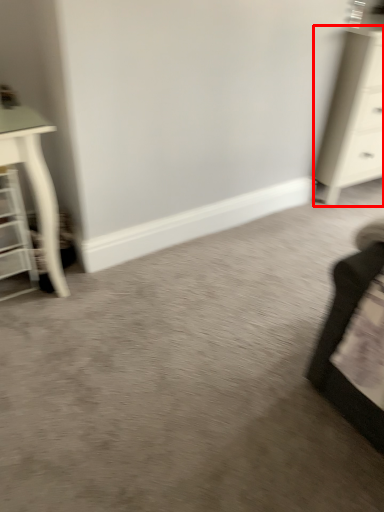
Question: Considering the relative positions of chest of drawers (annotated by the red box) and shelf in the image provided, where is chest of drawers (annotated by the red box) located with respect to the staircase?

Choices:
 (A) right
 (B) left

Answer: (A)